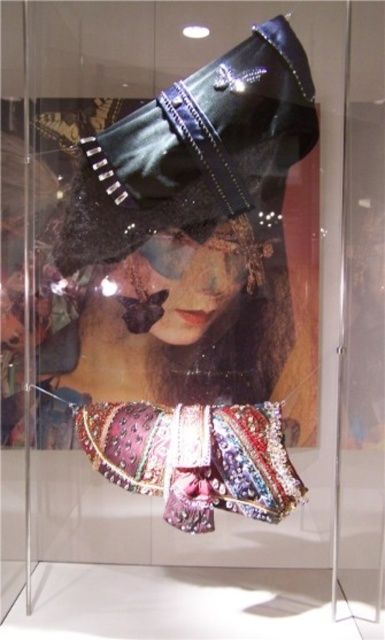
Can you confirm if leather-like black hat at upper center is taller than shiny sequined fabric at center?

Yes.

Between point (286, 115) and point (239, 465), which one is positioned in front?

Point (286, 115) is in front.

Image resolution: width=385 pixels, height=640 pixels. In order to click on leather-like black hat at upper center in this screenshot , I will do `click(192, 148)`.